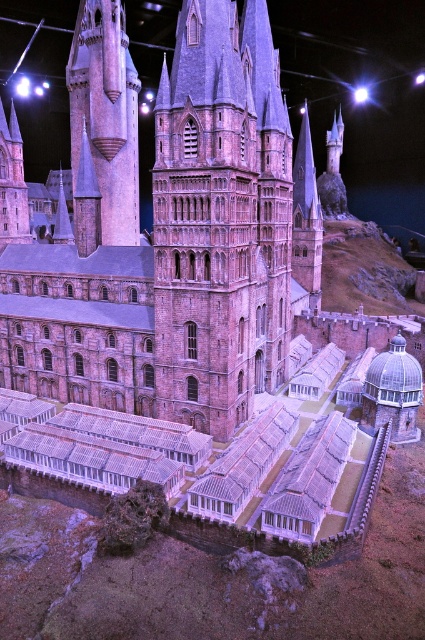
Consider the image. You are an architect examining a model of a medieval castle. You notice two towers in the model. The first is the brick stone tower at center, and the second is the brick tower at left. Which of these two towers is narrower in width?

The brick stone tower at center has a lesser width compared to brick tower at left, so it is narrower.

You are an architect reviewing a model of a medieval castle. The model has a brick stone tower at center. Where is the brick stone tower located in the model?

The brick stone tower at center is located at the coordinates point (221, 218).

You are an architect examining this model castle. You need to determine which tower is taller between the brick stone tower at center and the smooth stone tower at upper left. Based on the model, which one is taller?

The brick stone tower at center is taller than the smooth stone tower at upper left according to the model.